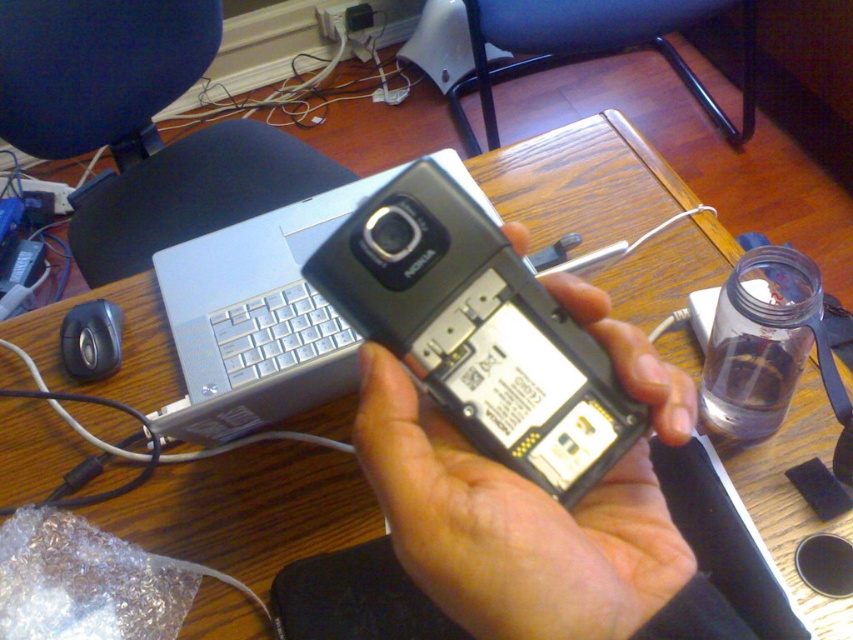
You are trying to locate two points on the desk. The first point is at coordinate point (624, 529) and the second is at point (770, 387). Which point is closer to you?

Point (624, 529) is closer to the viewer than point (770, 387).

You are trying to place the metallic silver phone at center and the clear glass bottle at right on a narrow shelf that can only fit one item. Based on their sizes, which item should you choose to fit on the shelf?

The metallic silver phone at center is wider than the clear glass bottle at right, so the clear glass bottle at right should be chosen to fit on the narrow shelf.